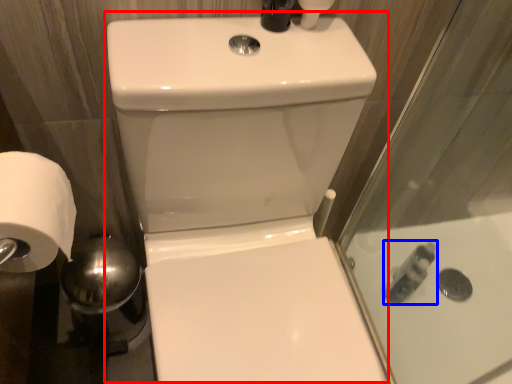
Question: Which of the following is the closest to the observer, sink (highlighted by a red box) or toiletry (highlighted by a blue box)?

Choices:
 (A) sink
 (B) toiletry

Answer: (A)